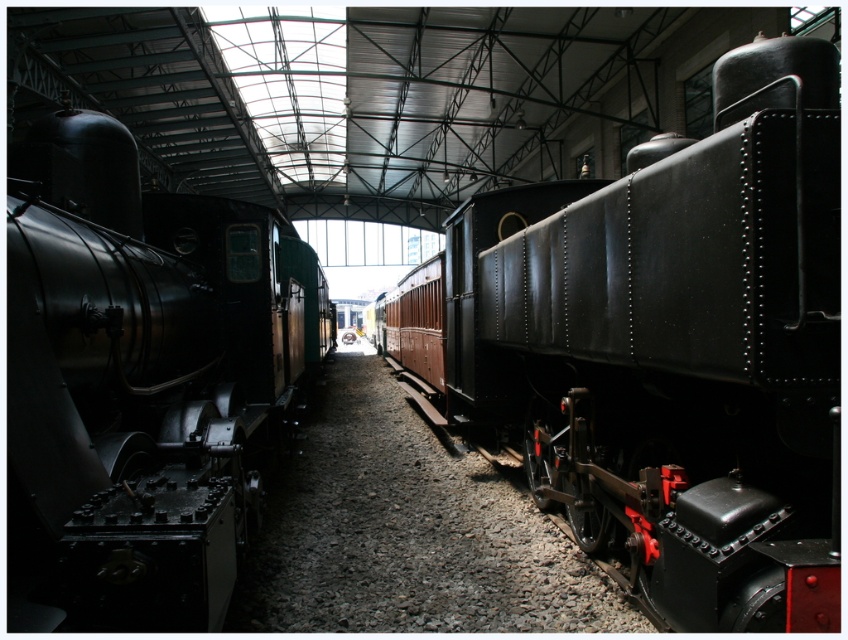
Can you confirm if matte black train at center is positioned to the right of gray gravel at center?

Yes, matte black train at center is to the right of gray gravel at center.

Does matte black train at center have a greater width compared to gray gravel at center?

No.

Measure the distance between matte black train at center and camera.

matte black train at center is 2.27 meters from camera.

Where is `matte black train at center`? The height and width of the screenshot is (640, 848). matte black train at center is located at coordinates (667, 348).

Does polished metal locomotive at left have a larger size compared to gray gravel at center?

Correct, polished metal locomotive at left is larger in size than gray gravel at center.

Can you confirm if polished metal locomotive at left is taller than gray gravel at center?

Yes, polished metal locomotive at left is taller than gray gravel at center.

Measure the distance between point (x=291, y=380) and camera.

Point (x=291, y=380) and camera are 9.53 meters apart.

At what (x,y) coordinates should I click in order to perform the action: click on polished metal locomotive at left. Please return your answer as a coordinate pair (x, y). The image size is (848, 640). Looking at the image, I should click on (143, 374).

The image size is (848, 640). What do you see at coordinates (667, 348) in the screenshot?
I see `matte black train at center` at bounding box center [667, 348].

Does matte black train at center lie behind polished metal locomotive at left?

Yes, matte black train at center is further from the viewer.

Does point (466, 323) come farther from viewer compared to point (261, 260)?

That is True.

At what (x,y) coordinates should I click in order to perform the action: click on matte black train at center. Please return your answer as a coordinate pair (x, y). This screenshot has height=640, width=848. Looking at the image, I should click on (667, 348).